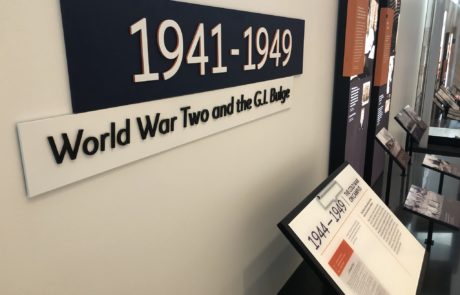
I want to click on open tan wall space under signs, bottom of image, so click(x=96, y=235), click(x=174, y=247), click(x=189, y=188), click(x=286, y=145).